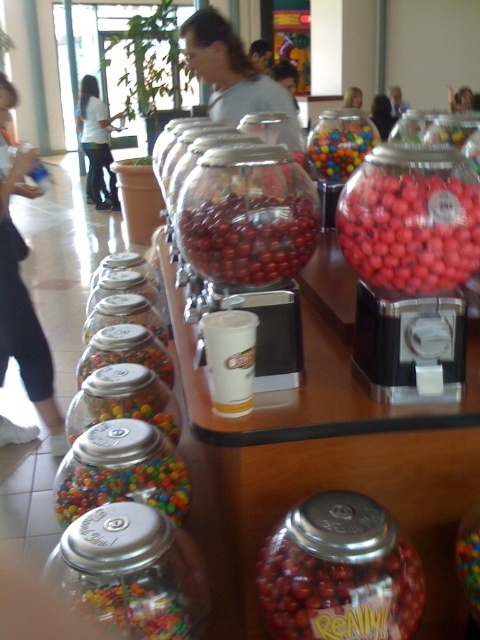
You are at a candy store and want to fill your cup with gumballs. You have a choice between the translucent plastic jar at center and the translucent plastic gumballs at lower left. Which container can hold more gumballs?

The translucent plastic jar at center might be wider than the translucent plastic gumballs at lower left, so it can hold more gumballs.

You are a customer at a candy store holding a white cup with a straw. You want to fill your cup with gumballs from the jar. The cup is placed exactly where the translucent plastic gumballs at lower left are. Can you reach the translucent plastic jar at center from your current position without moving the cup?

The distance between the translucent plastic jar at center and the translucent plastic gumballs at lower left is 11.64 inches. Since the cup is placed where the gumballs are, you can easily reach the jar as the distance is manageable for an average person to stretch their arm.